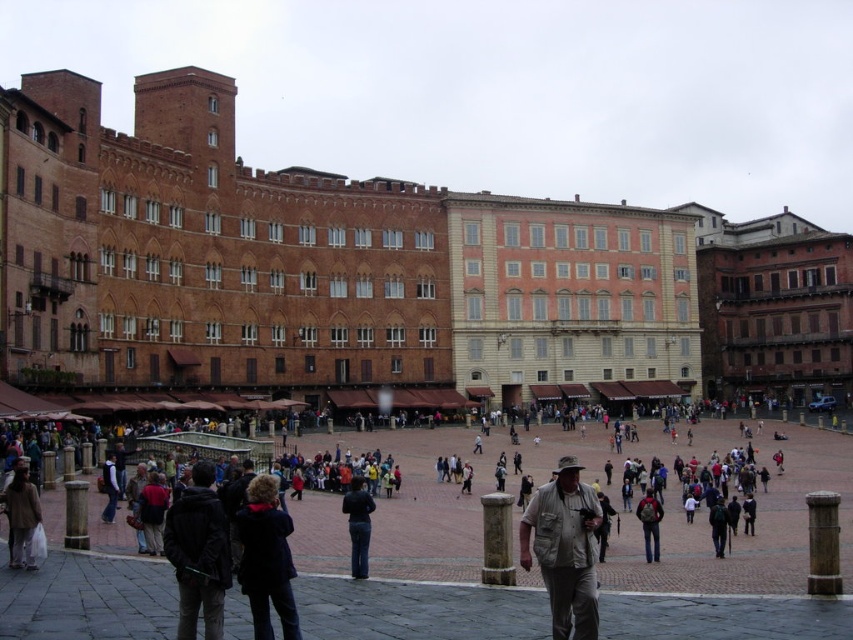
Question: Is khaki fabric hat at center thinner than light brown fabric jacket at lower left?

Choices:
 (A) yes
 (B) no

Answer: (B)

Question: Estimate the real-world distances between objects in this image. Which object is farther from the khaki fabric hat at center?

Choices:
 (A) dark blue fabric coat at lower center
 (B) dark gray jacket at lower left
 (C) dark green backpack at center
 (D) red backpack at center

Answer: (C)

Question: In this image, where is dark blue fabric coat at lower center located relative to light brown fabric jacket at lower left?

Choices:
 (A) below
 (B) above

Answer: (A)

Question: Does khaki fabric hat at center have a lesser width compared to dark blue fabric coat at lower center?

Choices:
 (A) yes
 (B) no

Answer: (B)

Question: Which object is positioned farthest from the dark gray jacket at lower left?

Choices:
 (A) dark blue jeans at center
 (B) light brown fabric jacket at lower left
 (C) red backpack at center

Answer: (C)

Question: Among these objects, which one is nearest to the camera?

Choices:
 (A) light brown fabric jacket at lower left
 (B) dark gray jacket at lower left
 (C) red backpack at center
 (D) dark blue fabric coat at lower center

Answer: (B)